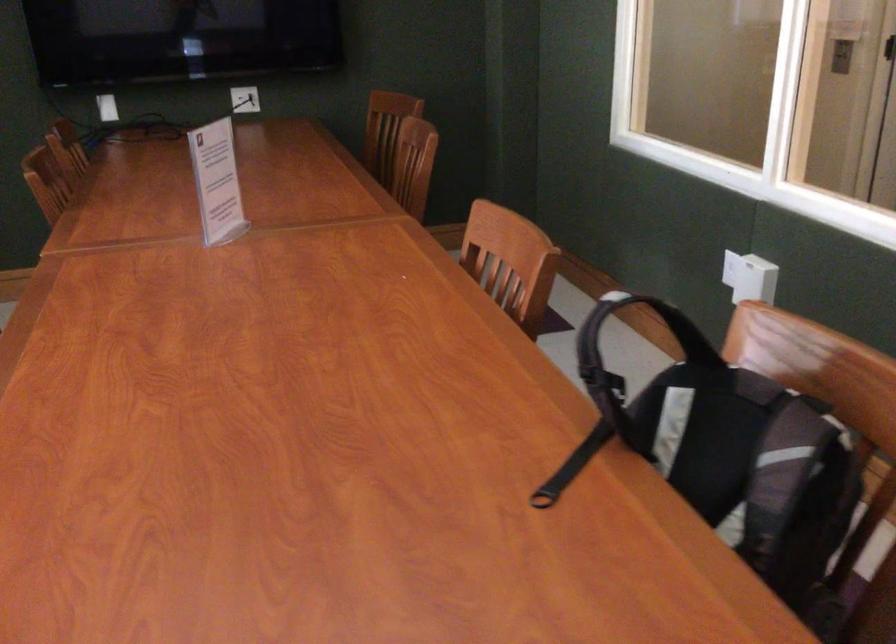
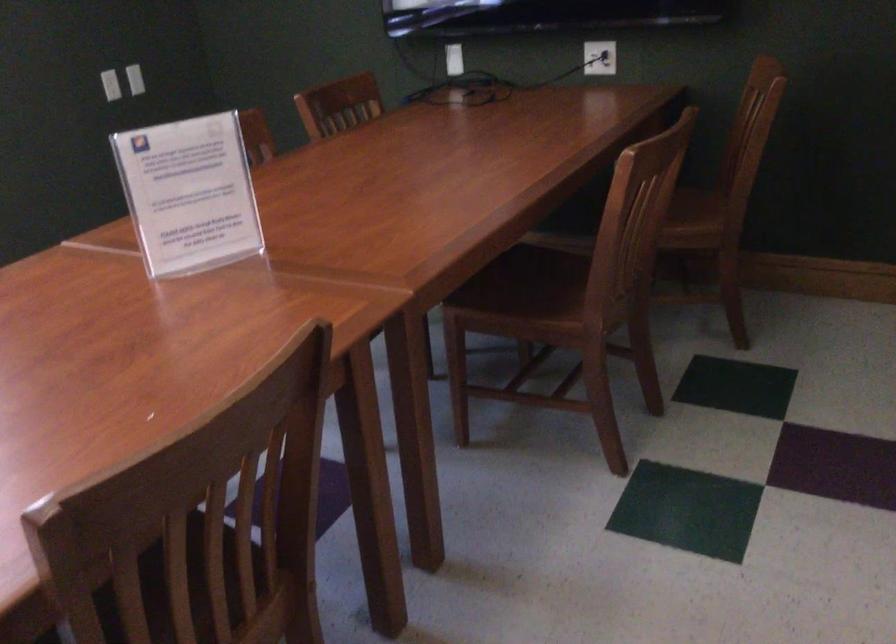
Find the pixel in the second image that matches point 123,102 in the first image.

(453, 59)